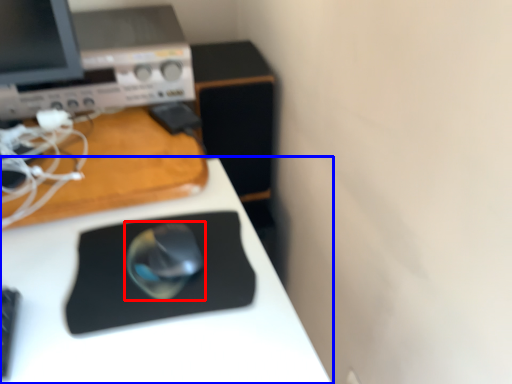
Question: Which of the following is the closest to the observer, mouse (highlighted by a red box) or desk (highlighted by a blue box)?

Choices:
 (A) mouse
 (B) desk

Answer: (B)